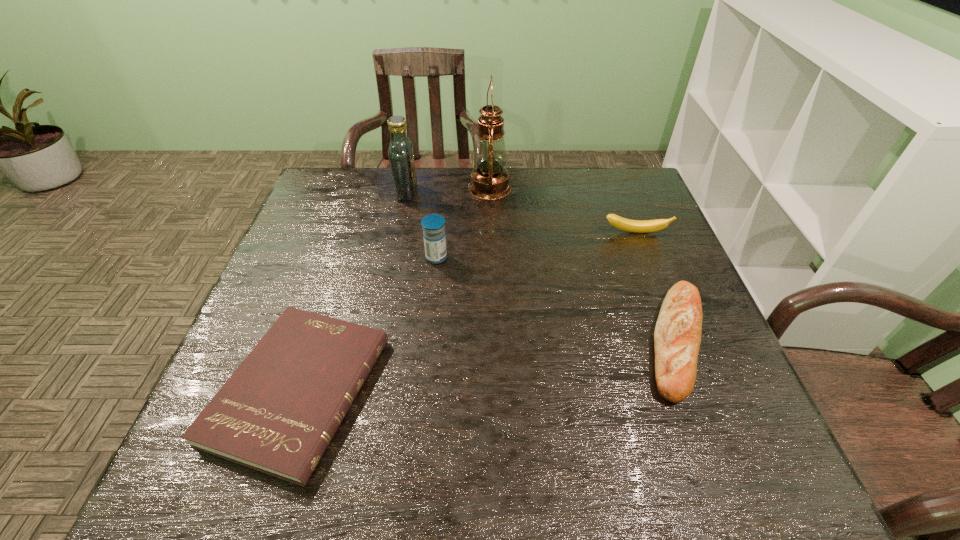
The image size is (960, 540). In order to click on object positioned at the near left corner in this screenshot , I will do `click(277, 413)`.

The height and width of the screenshot is (540, 960). What are the coordinates of `vacant area at the far edge of the desktop` in the screenshot? It's located at (541, 178).

In the image, there is a desktop. Identify the location of blank space at the right edge. (631, 278).

Where is `vacant space at the far left corner of the desktop`? The width and height of the screenshot is (960, 540). vacant space at the far left corner of the desktop is located at coordinates (354, 190).

In the image, there is a desktop. Where is `vacant space at the far right corner`? The width and height of the screenshot is (960, 540). vacant space at the far right corner is located at coordinates (600, 199).

The image size is (960, 540). Find the location of `vacant space in between the fourth nearest object and the fourth object from left to right`. vacant space in between the fourth nearest object and the fourth object from left to right is located at coordinates (563, 210).

Locate an element on the screen. free spot between the shortest object and the baguet is located at coordinates (488, 366).

You are a GUI agent. You are given a task and a screenshot of the screen. Output one action in this format:
    pyautogui.click(x=<x>, y=<y>)
    Task: Click on the vacant area between the baguet and the fourth object from right to left
    
    Given the screenshot: What is the action you would take?
    pyautogui.click(x=557, y=299)

Locate an element on the screen. The width and height of the screenshot is (960, 540). free spot between the third tallest object and the fourth nearest object is located at coordinates (536, 245).

What are the coordinates of `free spot between the hardback book and the fourth shortest object` in the screenshot? It's located at (368, 324).